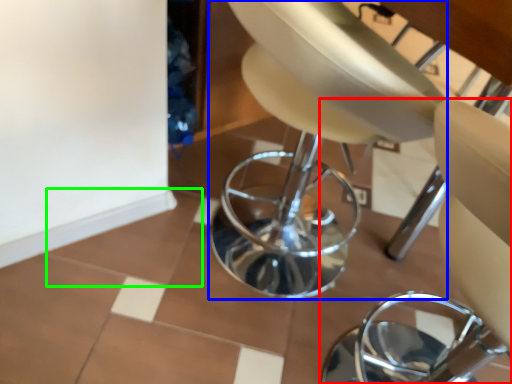
Question: Which object is the farthest from chair (highlighted by a red box)? Choose among these: swivel chair (highlighted by a blue box) or ceramic tile (highlighted by a green box).

Choices:
 (A) swivel chair
 (B) ceramic tile

Answer: (B)